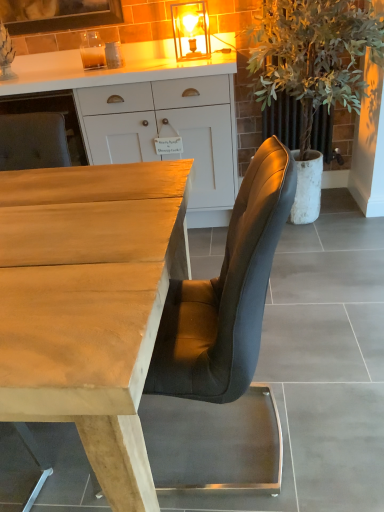
Question: Does matte glass lampshade at upper center have a lesser width compared to light brown wood desk at center?

Choices:
 (A) yes
 (B) no

Answer: (A)

Question: Can you confirm if matte glass lampshade at upper center is bigger than light brown wood desk at center?

Choices:
 (A) yes
 (B) no

Answer: (B)

Question: From the image's perspective, is matte glass lampshade at upper center located above light brown wood desk at center?

Choices:
 (A) no
 (B) yes

Answer: (B)

Question: Is matte glass lampshade at upper center placed right next to light brown wood desk at center?

Choices:
 (A) no
 (B) yes

Answer: (A)

Question: Is matte glass lampshade at upper center looking in the opposite direction of light brown wood desk at center?

Choices:
 (A) no
 (B) yes

Answer: (A)

Question: Is light brown wood desk at center inside or outside of matte glass lampshade at upper center?

Choices:
 (A) outside
 (B) inside

Answer: (A)

Question: Looking at their shapes, would you say light brown wood desk at center is wider or thinner than matte glass lampshade at upper center?

Choices:
 (A) thin
 (B) wide

Answer: (B)

Question: Considering the positions of light brown wood desk at center and matte glass lampshade at upper center in the image, is light brown wood desk at center bigger or smaller than matte glass lampshade at upper center?

Choices:
 (A) small
 (B) big

Answer: (B)

Question: In terms of height, does light brown wood desk at center look taller or shorter compared to matte glass lampshade at upper center?

Choices:
 (A) short
 (B) tall

Answer: (B)

Question: From a real-world perspective, relative to white wood cabinet at upper center, is green leafy plant at right vertically above or below?

Choices:
 (A) above
 (B) below

Answer: (A)

Question: Which is correct: green leafy plant at right is inside white wood cabinet at upper center, or outside of it?

Choices:
 (A) inside
 (B) outside

Answer: (B)

Question: Is green leafy plant at right taller or shorter than white wood cabinet at upper center?

Choices:
 (A) tall
 (B) short

Answer: (A)

Question: From the image's perspective, is green leafy plant at right located above or below white wood cabinet at upper center?

Choices:
 (A) above
 (B) below

Answer: (A)

Question: Considering the positions of white wood cabinet at upper center and light brown wood desk at center in the image, is white wood cabinet at upper center taller or shorter than light brown wood desk at center?

Choices:
 (A) tall
 (B) short

Answer: (A)

Question: Is white wood cabinet at upper center wider or thinner than light brown wood desk at center?

Choices:
 (A) wide
 (B) thin

Answer: (B)